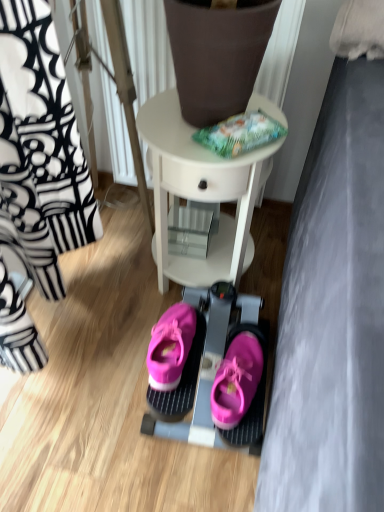
Question: Can you confirm if pink suede sneakers at center is thinner than pink fabric sneakers at center?

Choices:
 (A) yes
 (B) no

Answer: (A)

Question: Could you tell me if pink suede sneakers at center is facing pink fabric sneakers at center?

Choices:
 (A) no
 (B) yes

Answer: (A)

Question: Is pink suede sneakers at center far away from pink fabric sneakers at center?

Choices:
 (A) yes
 (B) no

Answer: (B)

Question: From the image's perspective, is pink suede sneakers at center over pink fabric sneakers at center?

Choices:
 (A) no
 (B) yes

Answer: (B)

Question: Considering the relative positions of pink suede sneakers at center and pink fabric sneakers at center in the image provided, is pink suede sneakers at center to the left of pink fabric sneakers at center from the viewer's perspective?

Choices:
 (A) yes
 (B) no

Answer: (A)

Question: From the image's perspective, is pink fabric sneakers at center located above or below white glossy table at center?

Choices:
 (A) above
 (B) below

Answer: (B)

Question: In terms of size, does pink fabric sneakers at center appear bigger or smaller than white glossy table at center?

Choices:
 (A) small
 (B) big

Answer: (A)

Question: From a real-world perspective, is pink fabric sneakers at center above or below white glossy table at center?

Choices:
 (A) above
 (B) below

Answer: (B)

Question: Is pink fabric sneakers at center spatially inside white glossy table at center, or outside of it?

Choices:
 (A) inside
 (B) outside

Answer: (B)

Question: Considering the positions of white glossy table at center and pink suede sneakers at center in the image, is white glossy table at center bigger or smaller than pink suede sneakers at center?

Choices:
 (A) small
 (B) big

Answer: (B)

Question: From a real-world perspective, is white glossy table at center above or below pink suede sneakers at center?

Choices:
 (A) below
 (B) above

Answer: (B)

Question: From the image's perspective, is white glossy table at center located above or below pink suede sneakers at center?

Choices:
 (A) below
 (B) above

Answer: (B)

Question: Based on their positions, is white glossy table at center located to the left or right of pink suede sneakers at center?

Choices:
 (A) left
 (B) right

Answer: (B)

Question: From a real-world perspective, is pink suede sneakers at center positioned above or below pink fabric sneakers at center?

Choices:
 (A) below
 (B) above

Answer: (B)

Question: Is pink suede sneakers at center wider or thinner than pink fabric sneakers at center?

Choices:
 (A) thin
 (B) wide

Answer: (A)